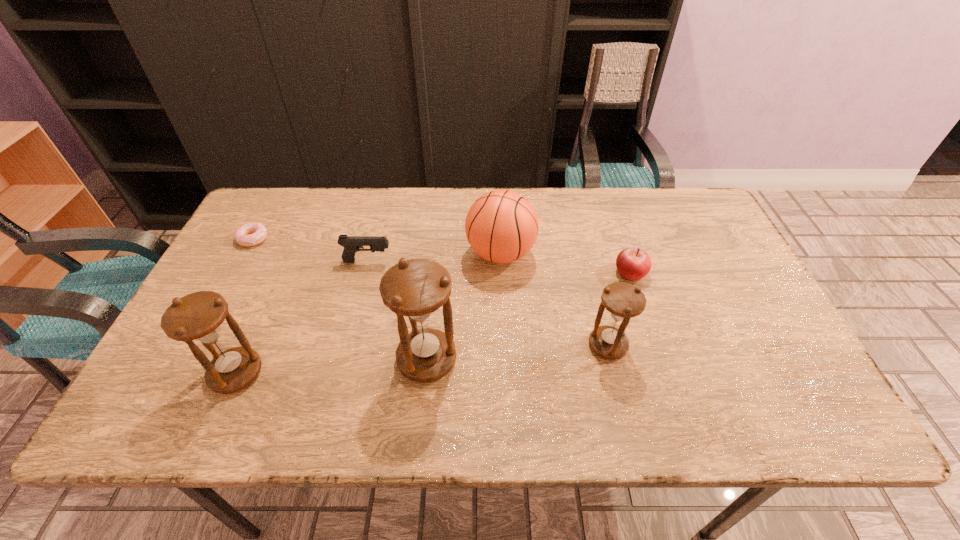
Find the location of a particular element. Image resolution: width=960 pixels, height=540 pixels. free space that is in between the tallest hourglass and the apple is located at coordinates (529, 316).

Find the location of a particular element. vacant space that's between the second object from left to right and the fourth object from right to left is located at coordinates (331, 366).

Locate an element on the screen. This screenshot has width=960, height=540. free space between the rightmost hourglass and the pistol is located at coordinates (488, 303).

You are a GUI agent. You are given a task and a screenshot of the screen. Output one action in this format:
    pyautogui.click(x=<x>, y=<y>)
    Task: Click on the unoccupied position between the rightmost object and the basketball
    The width and height of the screenshot is (960, 540).
    Given the screenshot: What is the action you would take?
    coord(565,264)

Where is `vacant space that's between the leftmost hourglass and the tallest hourglass`? Image resolution: width=960 pixels, height=540 pixels. vacant space that's between the leftmost hourglass and the tallest hourglass is located at coordinates (331, 366).

Where is `free space between the doughnut and the third object from left to right`? free space between the doughnut and the third object from left to right is located at coordinates (310, 250).

I want to click on empty location between the second tallest hourglass and the basketball, so click(369, 314).

What are the coordinates of `vacant area between the rightmost object and the leftmost hourglass` in the screenshot? It's located at (433, 323).

Choose which object is the sixth nearest neighbor to the tallest hourglass. Please provide its 2D coordinates. Your answer should be formatted as a tuple, i.e. [(x, y)], where the tuple contains the x and y coordinates of a point satisfying the conditions above.

[(250, 234)]

Where is `object that stands as the closest to the apple`? object that stands as the closest to the apple is located at coordinates (623, 301).